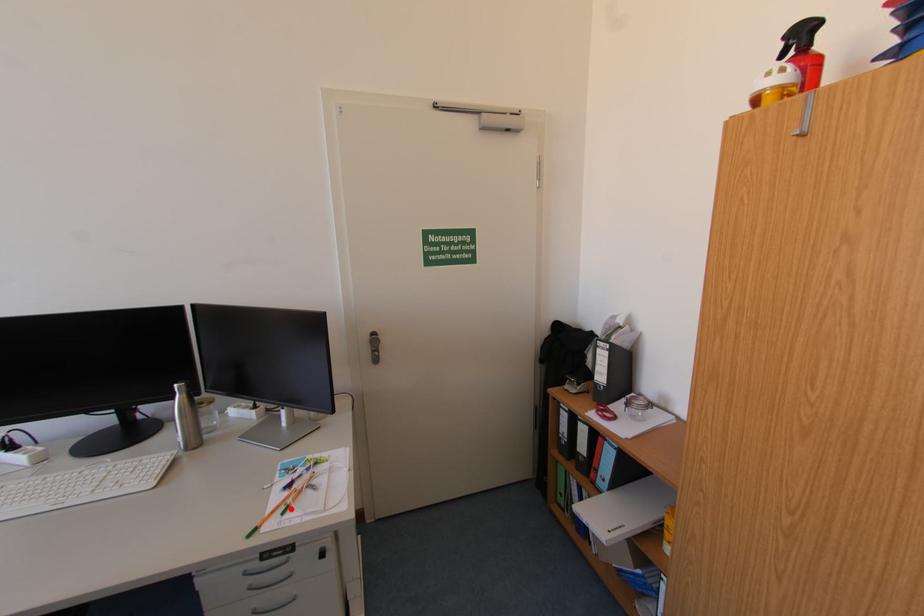
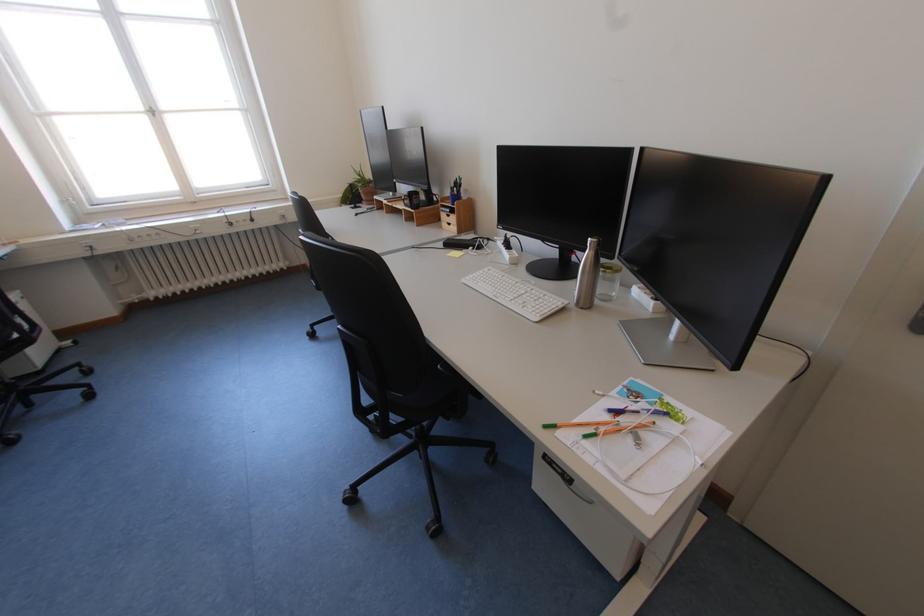
Locate, in the second image, the point that corresponds to the highlighted location in the first image.

(599, 431)